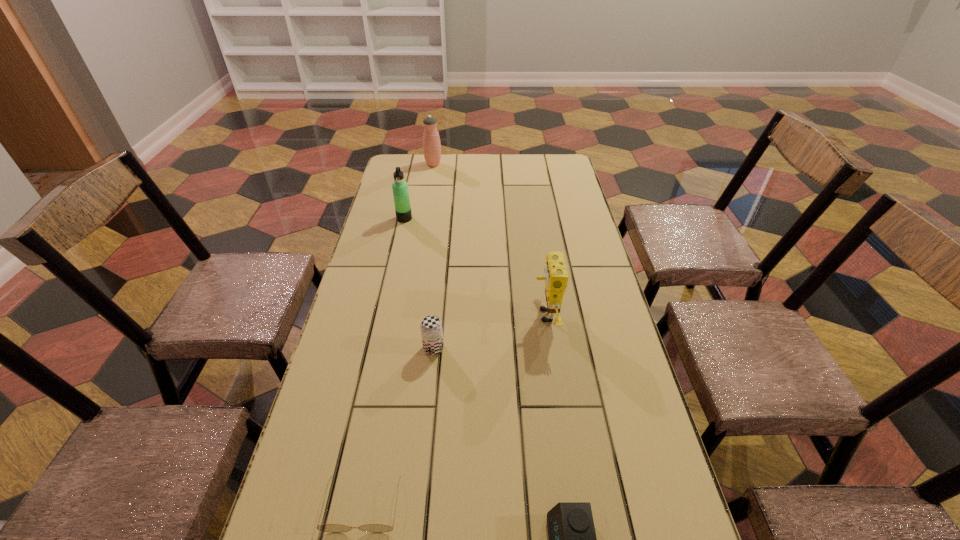
Locate an element on the screen. object identified as the fourth closest to the sunglasses is located at coordinates (400, 188).